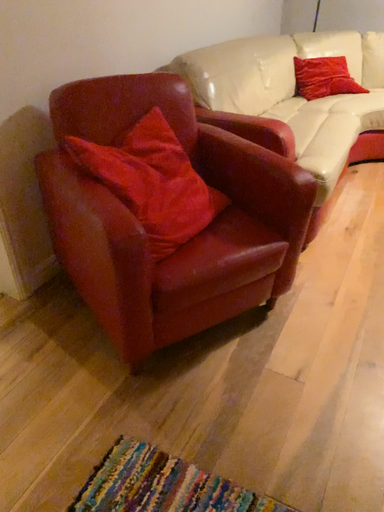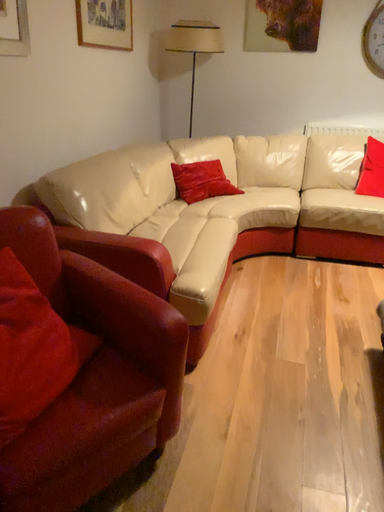
Question: Which way did the camera rotate in the video?

Choices:
 (A) rotated right
 (B) rotated left

Answer: (A)